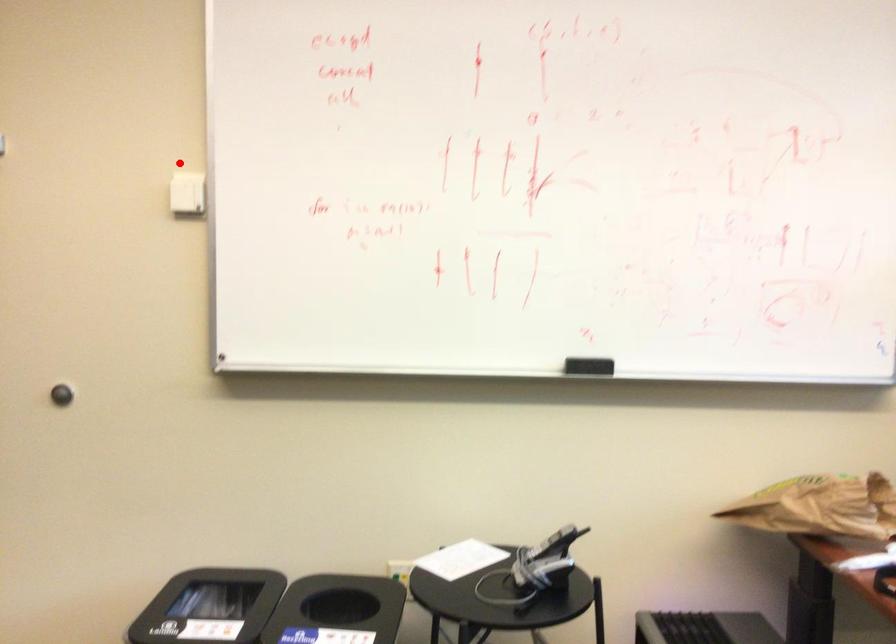
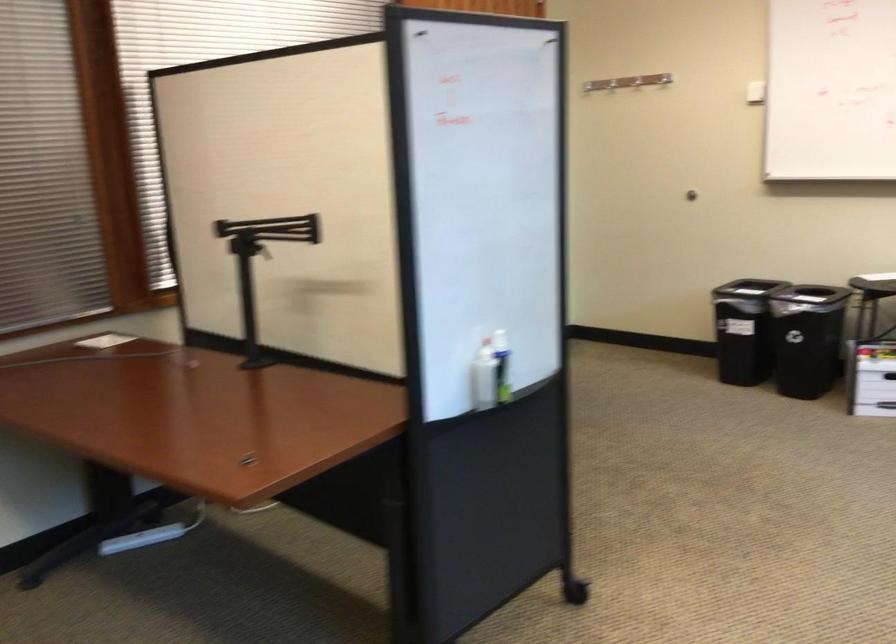
The point at the highlighted location is marked in the first image. Where is the corresponding point in the second image?

(664, 79)